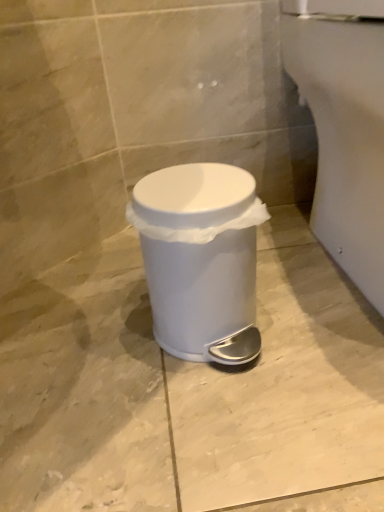
Find the location of a particular element. white plastic waste container at center is located at coordinates (201, 259).

This screenshot has width=384, height=512. Describe the element at coordinates (201, 259) in the screenshot. I see `white plastic waste container at center` at that location.

Measure the distance between point (211, 214) and camera.

19.69 inches.

Describe the element at coordinates (344, 127) in the screenshot. I see `white glossy porcelain at lower right` at that location.

At what (x,y) coordinates should I click in order to perform the action: click on white glossy porcelain at lower right. Please return your answer as a coordinate pair (x, y). Looking at the image, I should click on (344, 127).

What is the approximate height of white glossy porcelain at lower right?

The height of white glossy porcelain at lower right is 16.29 inches.

You are a GUI agent. You are given a task and a screenshot of the screen. Output one action in this format:
    pyautogui.click(x=<x>, y=<y>)
    Task: Click on the white plastic waste container at center
    
    Given the screenshot: What is the action you would take?
    pyautogui.click(x=201, y=259)

Considering the positions of objects white glossy porcelain at lower right and white plastic waste container at center in the image provided, who is more to the right, white glossy porcelain at lower right or white plastic waste container at center?

From the viewer's perspective, white glossy porcelain at lower right appears more on the right side.

Which object is further away from the camera taking this photo, white glossy porcelain at lower right or white plastic waste container at center?

white plastic waste container at center.

Does point (337, 27) appear closer or farther from the camera than point (208, 288)?

Point (337, 27) is farther from the camera than point (208, 288).

From the image's perspective, is white glossy porcelain at lower right above white plastic waste container at center?

Yes, from the image's perspective, white glossy porcelain at lower right is on top of white plastic waste container at center.

From a real-world perspective, between white glossy porcelain at lower right and white plastic waste container at center, who is vertically higher?

In real-world perspective, white glossy porcelain at lower right is above.

In the scene shown: Which object is thinner, white glossy porcelain at lower right or white plastic waste container at center?

Thinner between the two is white plastic waste container at center.

Between white glossy porcelain at lower right and white plastic waste container at center, which one has more height?

With more height is white glossy porcelain at lower right.

Considering the sizes of white glossy porcelain at lower right and white plastic waste container at center in the image, is white glossy porcelain at lower right bigger or smaller than white plastic waste container at center?

white glossy porcelain at lower right is bigger than white plastic waste container at center.

Is white plastic waste container at center a part of white glossy porcelain at lower right?

No, white plastic waste container at center is not a part of white glossy porcelain at lower right.

Is white glossy porcelain at lower right next to white plastic waste container at center and touching it?

No, white glossy porcelain at lower right is not beside white plastic waste container at center.

Does white glossy porcelain at lower right turn towards white plastic waste container at center?

No, white glossy porcelain at lower right is not turned towards white plastic waste container at center.

Based on the photo, can you tell me how much white glossy porcelain at lower right and white plastic waste container at center differ in facing direction?

31.2 degrees.

I want to click on waste container on the left of white glossy porcelain at lower right, so click(201, 259).

Considering the positions of objects white plastic waste container at center and white glossy porcelain at lower right in the image provided, who is more to the left, white plastic waste container at center or white glossy porcelain at lower right?

Positioned to the left is white plastic waste container at center.

Relative to white glossy porcelain at lower right, is white plastic waste container at center in front or behind?

In the image, white plastic waste container at center appears behind white glossy porcelain at lower right.

Is point (184, 180) farther from camera compared to point (332, 67)?

No, (184, 180) is in front of (332, 67).

From the image's perspective, between white plastic waste container at center and white glossy porcelain at lower right, who is located below?

From the image's view, white plastic waste container at center is below.

From a real-world perspective, which is physically above, white plastic waste container at center or white glossy porcelain at lower right?

From a 3D spatial view, white glossy porcelain at lower right is above.

Based on the photo, between white plastic waste container at center and white glossy porcelain at lower right, which one has larger width?

Wider between the two is white glossy porcelain at lower right.

Who is taller, white plastic waste container at center or white glossy porcelain at lower right?

white glossy porcelain at lower right.

Is white plastic waste container at center bigger or smaller than white glossy porcelain at lower right?

In the image, white plastic waste container at center appears to be smaller than white glossy porcelain at lower right.

Is white plastic waste container at center positioned beyond the bounds of white glossy porcelain at lower right?

Yes, white plastic waste container at center is not within white glossy porcelain at lower right.

Is white plastic waste container at center next to white glossy porcelain at lower right?

white plastic waste container at center and white glossy porcelain at lower right are clearly separated.

Consider the image. Could you tell me if white plastic waste container at center is turned towards white glossy porcelain at lower right?

No, white plastic waste container at center is not oriented towards white glossy porcelain at lower right.

Can you tell me how much white plastic waste container at center and white glossy porcelain at lower right differ in facing direction?

There is a 31.2-degree angle between the facing directions of white plastic waste container at center and white glossy porcelain at lower right.

How much distance is there between white plastic waste container at center and white glossy porcelain at lower right?

They are 10.71 inches apart.

Locate an element on the screen. waste container below the white glossy porcelain at lower right (from the image's perspective) is located at coordinates (201, 259).

At what (x,y) coordinates should I click in order to perform the action: click on waste container beneath the white glossy porcelain at lower right (from a real-world perspective). Please return your answer as a coordinate pair (x, y). Looking at the image, I should click on (201, 259).

Where is `porcelain located on the right of white plastic waste container at center`? porcelain located on the right of white plastic waste container at center is located at coordinates click(x=344, y=127).